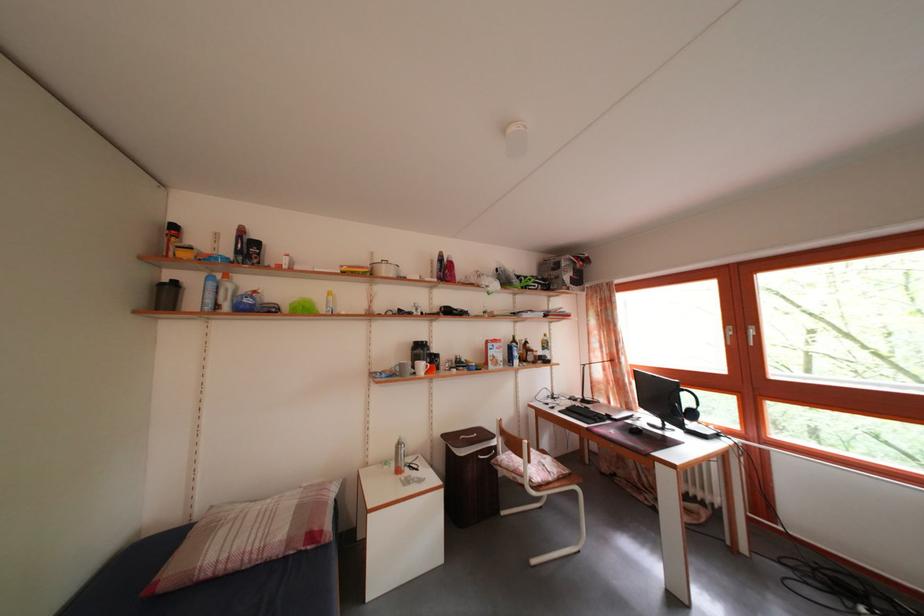
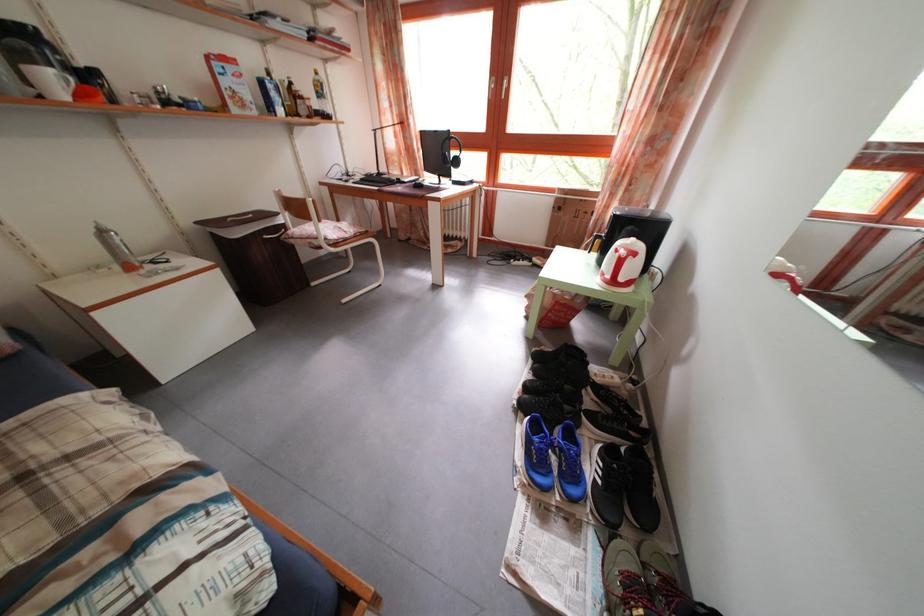
Locate, in the second image, the point that corresponds to (x=407, y=451) in the first image.

(108, 238)